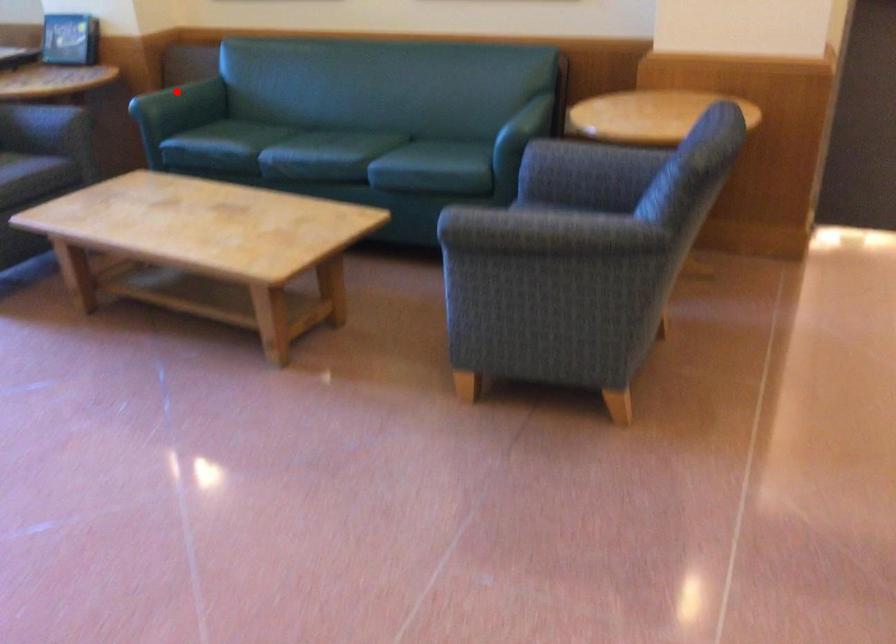
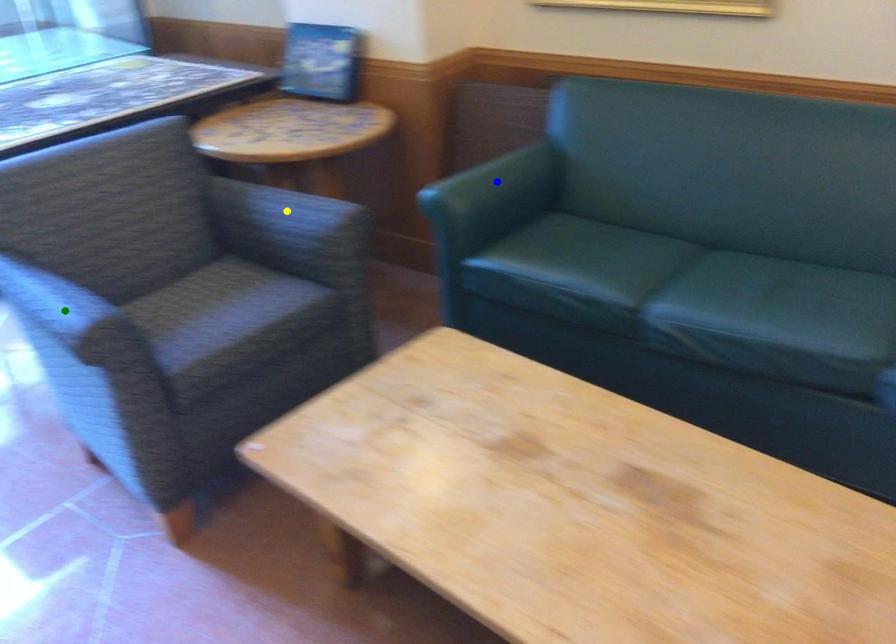
Question: I am providing you with two images of the same scene from different viewpoints. A red point is marked on the first image. You are given multiple points on the second image. In image 2, which mark is for the same physical point as the one in image 1?

Choices:
 (A) yellow point
 (B) green point
 (C) blue point

Answer: (C)